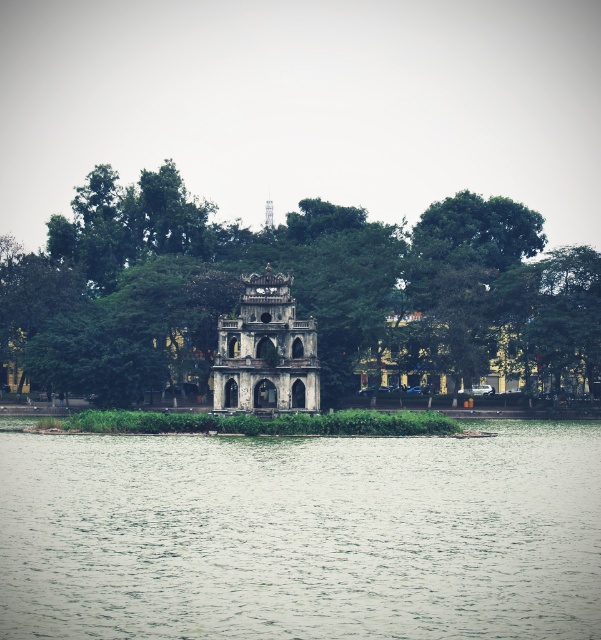
Between green water at center and stone aged tower at center, which one has less height?

Standing shorter between the two is green water at center.

Does point (531, 497) come behind point (284, 340)?

No, it is in front of (284, 340).

Where is `green water at center`? green water at center is located at coordinates (302, 534).

At what (x,y) coordinates should I click in order to perform the action: click on green water at center. Please return your answer as a coordinate pair (x, y). Looking at the image, I should click on (302, 534).

Which is more to the right, green leafy tree at center or stone aged tower at center?

From the viewer's perspective, green leafy tree at center appears more on the right side.

Which of these two, green leafy tree at center or stone aged tower at center, stands taller?

Standing taller between the two is green leafy tree at center.

The width and height of the screenshot is (601, 640). Identify the location of green leafy tree at center. (296, 289).

Does green water at center have a lesser height compared to green leafy tree at center?

Correct, green water at center is not as tall as green leafy tree at center.

Is point (135, 445) in front of point (477, 310)?

Yes, it is.

Where is `green water at center`? green water at center is located at coordinates (302, 534).